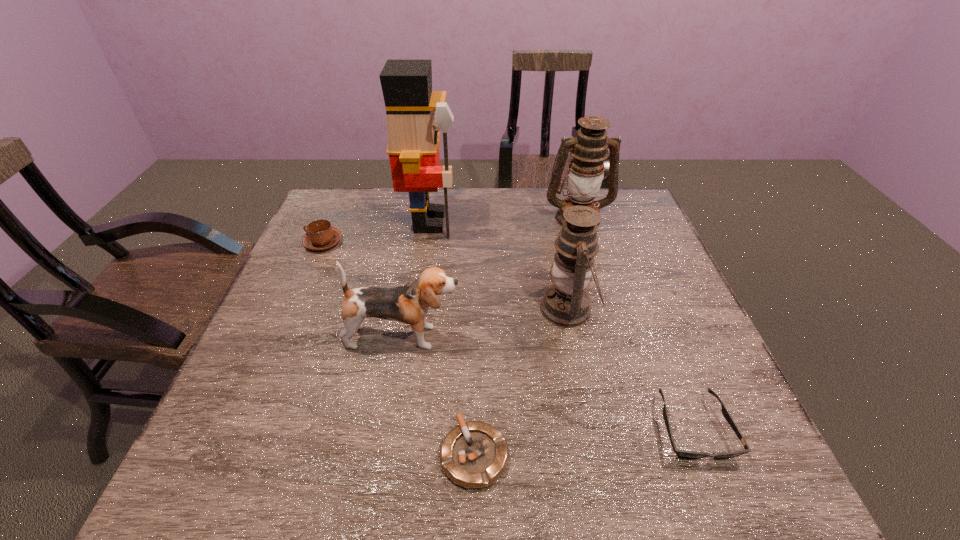
At what (x,y) coordinates should I click in order to perform the action: click on free space between the nearer oil lamp and the second shortest object. Please return your answer as a coordinate pair (x, y). This screenshot has height=540, width=960. Looking at the image, I should click on (x=631, y=369).

Identify the location of empty space between the tallest object and the third shortest object. This screenshot has height=540, width=960. (376, 232).

The image size is (960, 540). I want to click on free space that is in between the nutcracker and the nearer oil lamp, so click(499, 265).

This screenshot has width=960, height=540. I want to click on free space between the farther oil lamp and the puppy, so click(x=491, y=278).

Identify which object is the third closest to the shortest object. Please provide its 2D coordinates. Your answer should be formatted as a tuple, i.e. [(x, y)], where the tuple contains the x and y coordinates of a point satisfying the conditions above.

[(686, 454)]

Where is `object that can be found as the second closest to the tallest object`? The width and height of the screenshot is (960, 540). object that can be found as the second closest to the tallest object is located at coordinates (589, 149).

The height and width of the screenshot is (540, 960). Find the location of `free space that satisfies the following two spatial constraints: 1. on the side of the nearer oil lamp with the handle; 2. on the left side of the fifth tallest object`. free space that satisfies the following two spatial constraints: 1. on the side of the nearer oil lamp with the handle; 2. on the left side of the fifth tallest object is located at coordinates (295, 309).

Find the location of a particular element. Image resolution: width=960 pixels, height=540 pixels. free space that satisfies the following two spatial constraints: 1. on the side of the nearer oil lamp with the handle; 2. on the left side of the cappuccino is located at coordinates (295, 309).

You are a GUI agent. You are given a task and a screenshot of the screen. Output one action in this format:
    pyautogui.click(x=<x>, y=<y>)
    Task: Click on the vacant region that satisfies the following two spatial constraints: 1. at the face of the puppy; 2. on the left side of the shortest object
    The image size is (960, 540).
    Given the screenshot: What is the action you would take?
    pyautogui.click(x=384, y=454)

The image size is (960, 540). In order to click on vacant region that satisfies the following two spatial constraints: 1. on the back side of the farther oil lamp; 2. on the right side of the shortest object in this screenshot , I will do `click(477, 218)`.